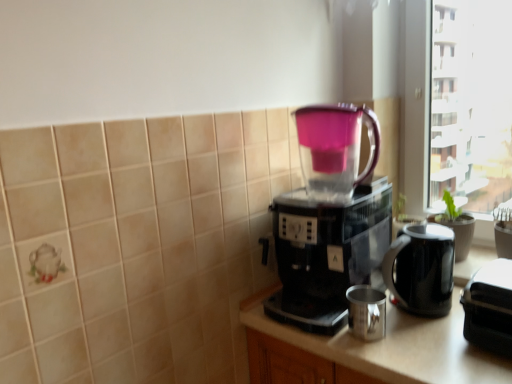
Identify the location of free space underneath black glossy electric kettle at right (from a real-world perspective). (422, 318).